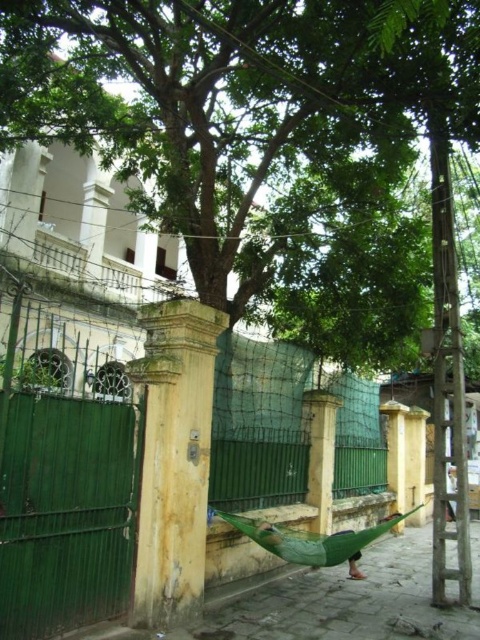
Question: Observing the image, what is the correct spatial positioning of green leafy tree at center in reference to green metal fence at center?

Choices:
 (A) above
 (B) below

Answer: (A)

Question: Which object is farther from the camera taking this photo?

Choices:
 (A) green leafy tree at center
 (B) green metal fence at center

Answer: (B)

Question: Among these objects, which one is nearest to the camera?

Choices:
 (A) green leafy tree at center
 (B) green metal fence at center

Answer: (A)

Question: Is green leafy tree at center positioned before green metal fence at center?

Choices:
 (A) yes
 (B) no

Answer: (A)

Question: Is green leafy tree at center wider than green metal fence at center?

Choices:
 (A) no
 (B) yes

Answer: (B)